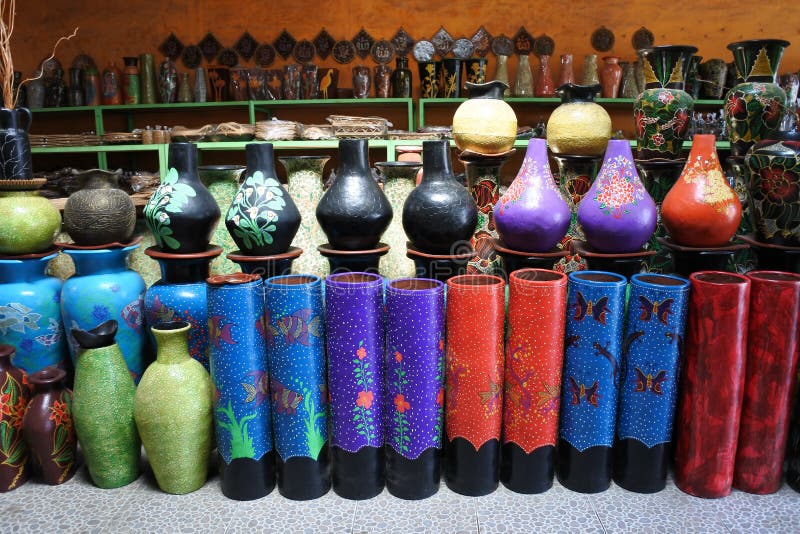
Identify the location of cylinder vase type thing. This screenshot has width=800, height=534. (233, 334), (265, 339), (338, 354), (430, 353), (470, 358), (521, 360), (600, 359), (673, 364), (710, 368), (753, 373).